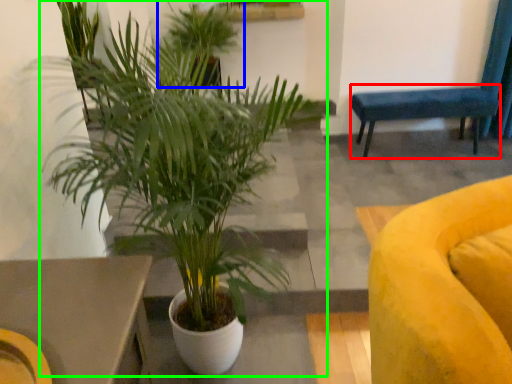
Question: Based on their relative distances, which object is nearer to armchair (highlighted by a red box)? Choose from houseplant (highlighted by a blue box) and houseplant (highlighted by a green box).

Choices:
 (A) houseplant
 (B) houseplant

Answer: (A)